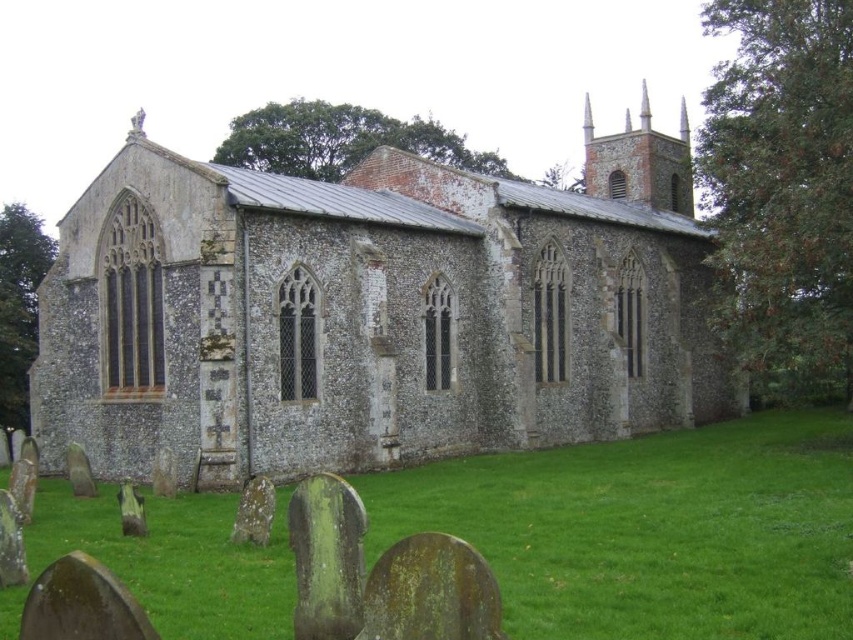
Is speckled stone church at center to the left of green grass at lower center from the viewer's perspective?

Incorrect, speckled stone church at center is not on the left side of green grass at lower center.

Is point (212, 225) in front of point (280, 596)?

No.

The height and width of the screenshot is (640, 853). In order to click on speckled stone church at center in this screenshot , I will do `click(373, 312)`.